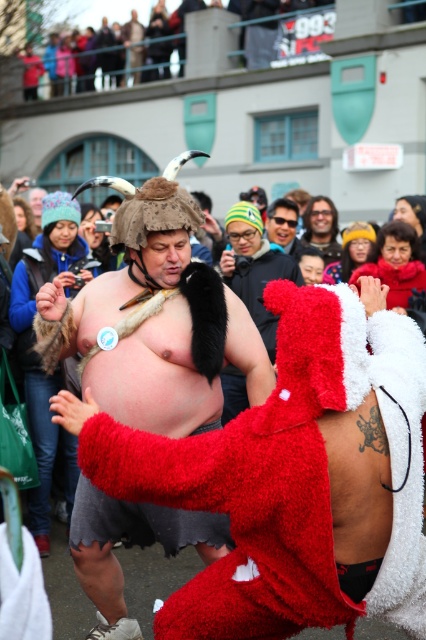
Question: Is matte black jacket at upper center further to camera compared to shiny black hair at center?

Choices:
 (A) no
 (B) yes

Answer: (B)

Question: Which point appears closest to the camera in this image?

Choices:
 (A) (275, 342)
 (B) (328, 209)
 (C) (218, 470)

Answer: (C)

Question: Is fuzzy red bear at center smaller than matte black sunglasses at center?

Choices:
 (A) no
 (B) yes

Answer: (A)

Question: Which of the following is the closest to the observer?

Choices:
 (A) (261, 224)
 (B) (279, 61)
 (C) (284, 440)
 (D) (65, 433)

Answer: (C)

Question: Which of the following is the farthest from the observer?

Choices:
 (A) fuzzy red bear at center
 (B) matte black jacket at upper center
 (C) matte black sunglasses at center

Answer: (B)

Question: Can you confirm if fuzzy red santa at center is positioned to the left of fuzzy red robe at center?

Choices:
 (A) yes
 (B) no

Answer: (B)